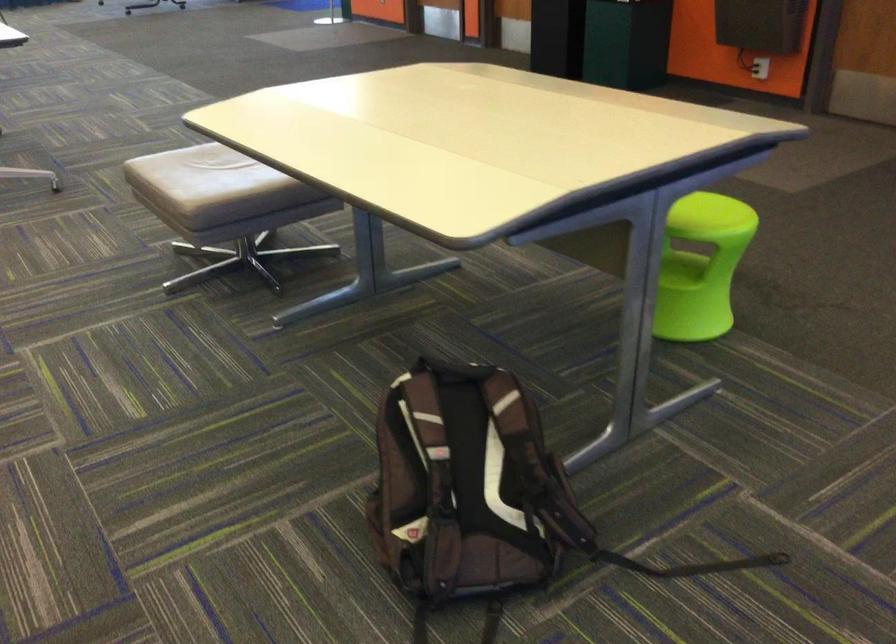
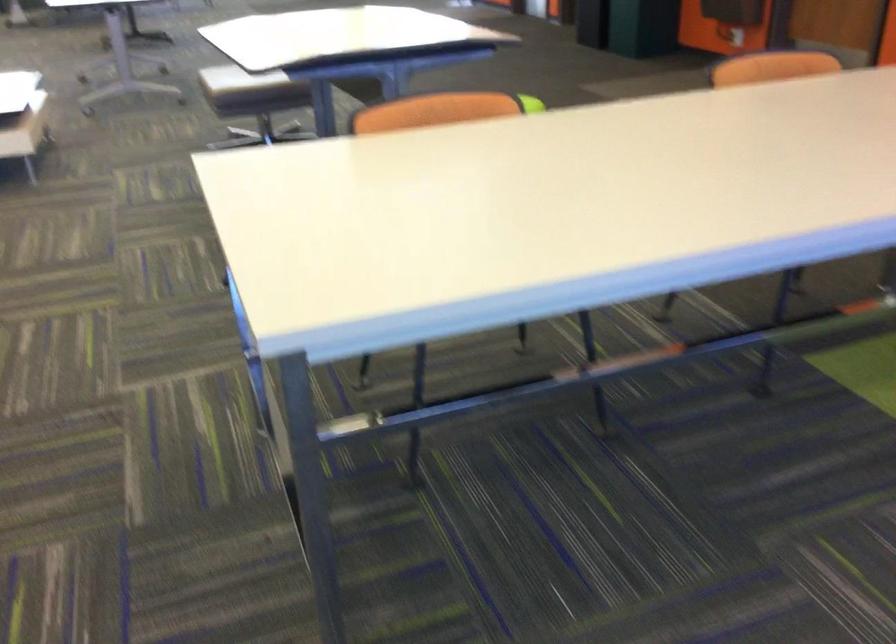
In a continuous first-person perspective shot, in which direction is the camera moving?

The movement direction of the cameraman is right, backward.